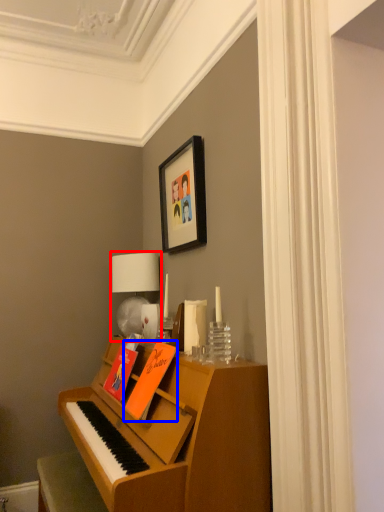
Question: Which point is further to the camera, table lamp (highlighted by a red box) or book (highlighted by a blue box)?

Choices:
 (A) table lamp
 (B) book

Answer: (A)